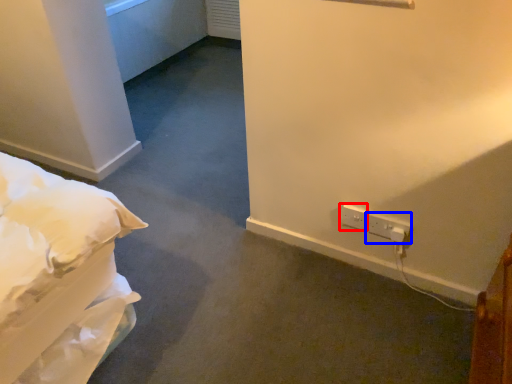
Question: Which of the following is the farthest to the observer, electric outlet (highlighted by a red box) or electric outlet (highlighted by a blue box)?

Choices:
 (A) electric outlet
 (B) electric outlet

Answer: (A)